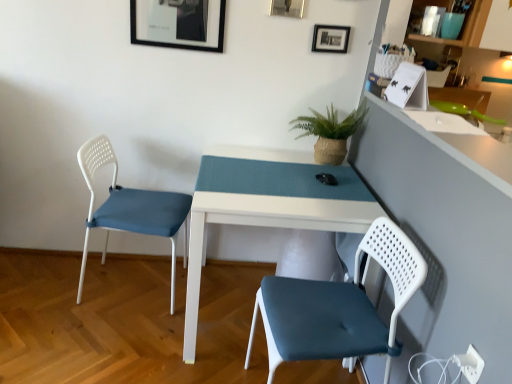
Describe the element at coordinates (465, 28) in the screenshot. I see `matte glass shelf at upper right` at that location.

This screenshot has height=384, width=512. Find the location of `white matte table at center`. white matte table at center is located at coordinates (268, 205).

Describe the element at coordinates (131, 209) in the screenshot. I see `white plastic chair at left, which is the second chair from right to left` at that location.

The width and height of the screenshot is (512, 384). What do you see at coordinates (178, 24) in the screenshot? I see `matte black picture frame at upper center, marked as the 3th picture frame in a right-to-left arrangement` at bounding box center [178, 24].

Measure the distance between matte white chair at lower right, the 1th chair from the right, and camera.

matte white chair at lower right, the 1th chair from the right, and camera are 1.26 meters apart.

Find the location of a particular element. The image size is (512, 384). matte white chair at lower right, which appears as the second chair when viewed from the back is located at coordinates (338, 307).

Locate an element on the screen. matte glass shelf at upper right is located at coordinates (465, 28).

Is point (479, 30) closer or farther from the camera than point (274, 14)?

Point (479, 30).

Which object is wider, matte glass shelf at upper right or metallic silver picture frame at upper center, placed as the 2th picture frame when sorted from left to right?

matte glass shelf at upper right.

From a real-world perspective, which is physically below, matte glass shelf at upper right or metallic silver picture frame at upper center, placed as the 2th picture frame when sorted from left to right?

matte glass shelf at upper right is physically lower.

How many degrees apart are the facing directions of matte glass shelf at upper right and metallic silver picture frame at upper center, placed as the 2th picture frame when sorted from left to right?

The facing directions of matte glass shelf at upper right and metallic silver picture frame at upper center, placed as the 2th picture frame when sorted from left to right, are 49.9 degrees apart.

Considering the sizes of objects white plastic chair at left, the 1th chair viewed from the left, and white matte table at center in the image provided, who is smaller, white plastic chair at left, the 1th chair viewed from the left, or white matte table at center?

white plastic chair at left, the 1th chair viewed from the left, is smaller.

Does white plastic chair at left, the 1th chair viewed from the left, have a lesser height compared to white matte table at center?

No, white plastic chair at left, the 1th chair viewed from the left, is not shorter than white matte table at center.

Are white plastic chair at left, positioned as the 2th chair in front-to-back order, and white matte table at center located far from each other?

That's not correct — white plastic chair at left, positioned as the 2th chair in front-to-back order, is a little close to white matte table at center.

The image size is (512, 384). Find the location of `the 2nd picture frame counting from the right side of the white matte table at center`. the 2nd picture frame counting from the right side of the white matte table at center is located at coordinates (330, 38).

Based on the photo, between white matte table at center and black matte picture frame at upper center, which appears as the 3th picture frame when viewed from the left, which one has more height?

Standing taller between the two is white matte table at center.

Which object is closer to the camera, white matte table at center or black matte picture frame at upper center, which is the 1th picture frame from right to left?

white matte table at center is in front.

Which of these two, white matte table at center or black matte picture frame at upper center, which is the 1th picture frame from right to left, is bigger?

With larger size is white matte table at center.

How many degrees apart are the facing directions of green woven pot at upper center and metallic silver picture frame at upper center, acting as the second picture frame starting from the right?

green woven pot at upper center and metallic silver picture frame at upper center, acting as the second picture frame starting from the right, are facing 1.02 degrees away from each other.

Is green woven pot at upper center aimed at metallic silver picture frame at upper center, placed as the 2th picture frame when sorted from left to right?

No, green woven pot at upper center is not aimed at metallic silver picture frame at upper center, placed as the 2th picture frame when sorted from left to right.

Considering the relative sizes of green woven pot at upper center and metallic silver picture frame at upper center, placed as the 2th picture frame when sorted from left to right, in the image provided, is green woven pot at upper center shorter than metallic silver picture frame at upper center, placed as the 2th picture frame when sorted from left to right,?

No.

Which of these two, green woven pot at upper center or metallic silver picture frame at upper center, placed as the 2th picture frame when sorted from left to right, is smaller?

With smaller size is metallic silver picture frame at upper center, placed as the 2th picture frame when sorted from left to right.

Are white plastic chair at left, the 1th chair viewed from the left, and matte glass shelf at upper right located far from each other?

Indeed, white plastic chair at left, the 1th chair viewed from the left, is not near matte glass shelf at upper right.

In the scene shown: Can you confirm if white plastic chair at left, which is the second chair from right to left, is taller than matte glass shelf at upper right?

Yes, white plastic chair at left, which is the second chair from right to left, is taller than matte glass shelf at upper right.

From a real-world perspective, does white plastic chair at left, positioned as the 2th chair in front-to-back order, sit lower than matte glass shelf at upper right?

Yes, from a real-world perspective, white plastic chair at left, positioned as the 2th chair in front-to-back order, is under matte glass shelf at upper right.

Is metallic silver picture frame at upper center, placed as the 2th picture frame when sorted from left to right, to the right of matte black picture frame at upper center, the first picture frame from the left, from the viewer's perspective?

Yes, metallic silver picture frame at upper center, placed as the 2th picture frame when sorted from left to right, is to the right of matte black picture frame at upper center, the first picture frame from the left.

Could you measure the distance between metallic silver picture frame at upper center, placed as the 2th picture frame when sorted from left to right, and matte black picture frame at upper center, the first picture frame from the left?

metallic silver picture frame at upper center, placed as the 2th picture frame when sorted from left to right, is 16.54 inches from matte black picture frame at upper center, the first picture frame from the left.

Considering the positions of point (295, 5) and point (131, 22), is point (295, 5) closer or farther from the camera than point (131, 22)?

Clearly, point (295, 5) is more distant from the camera than point (131, 22).

This screenshot has width=512, height=384. I want to click on the 1st picture frame behind the matte black picture frame at upper center, the first picture frame from the left, starting your count from the anchor, so click(x=287, y=8).

Is black matte picture frame at upper center, which appears as the 3th picture frame when viewed from the left, facing towards green woven pot at upper center?

No, black matte picture frame at upper center, which appears as the 3th picture frame when viewed from the left, does not turn towards green woven pot at upper center.

Considering the relative sizes of black matte picture frame at upper center, which is the 1th picture frame from right to left, and green woven pot at upper center in the image provided, is black matte picture frame at upper center, which is the 1th picture frame from right to left, smaller than green woven pot at upper center?

Indeed, black matte picture frame at upper center, which is the 1th picture frame from right to left, has a smaller size compared to green woven pot at upper center.

Is black matte picture frame at upper center, which appears as the 3th picture frame when viewed from the left, to the left or to the right of green woven pot at upper center in the image?

black matte picture frame at upper center, which appears as the 3th picture frame when viewed from the left, is to the right of green woven pot at upper center.

In order to click on shelf lying in front of the metallic silver picture frame at upper center, placed as the 2th picture frame when sorted from left to right in this screenshot , I will do `click(465, 28)`.

From a real-world perspective, count 2nd chairs upward from the white matte table at center and point to it. Please provide its 2D coordinates.

[(131, 209)]

Estimate the real-world distances between objects in this image. Which object is closer to green woven pot at upper center, matte white chair at lower right, marked as the second chair in a left-to-right arrangement, or matte black picture frame at upper center, marked as the 3th picture frame in a right-to-left arrangement?

The object closer to green woven pot at upper center is matte black picture frame at upper center, marked as the 3th picture frame in a right-to-left arrangement.

When comparing their distances from green woven pot at upper center, does white plastic chair at left, the 1th chair viewed from the left, or metallic silver picture frame at upper center, placed as the 2th picture frame when sorted from left to right, seem closer?

metallic silver picture frame at upper center, placed as the 2th picture frame when sorted from left to right.

Based on their spatial positions, is green woven pot at upper center or matte white chair at lower right, which appears as the second chair when viewed from the back, further from metallic silver picture frame at upper center, placed as the 2th picture frame when sorted from left to right?

matte white chair at lower right, which appears as the second chair when viewed from the back, is positioned further to the anchor metallic silver picture frame at upper center, placed as the 2th picture frame when sorted from left to right.

Based on the photo, considering their positions, is matte black picture frame at upper center, marked as the 3th picture frame in a right-to-left arrangement, positioned closer to white matte table at center than green woven pot at upper center?

Based on the image, green woven pot at upper center appears to be nearer to white matte table at center.

Looking at the image, which one is located further to metallic silver picture frame at upper center, acting as the second picture frame starting from the right, white matte table at center or matte glass shelf at upper right?

Based on the image, white matte table at center appears to be further to metallic silver picture frame at upper center, acting as the second picture frame starting from the right.

Looking at the image, which one is located further to matte glass shelf at upper right, white plastic chair at left, the 1th chair viewed from the left, or metallic silver picture frame at upper center, acting as the second picture frame starting from the right?

The object further to matte glass shelf at upper right is white plastic chair at left, the 1th chair viewed from the left.

Based on their spatial positions, is matte black picture frame at upper center, marked as the 3th picture frame in a right-to-left arrangement, or matte white chair at lower right, which is the 1th chair in front-to-back order, closer to black matte picture frame at upper center, which is the 1th picture frame from right to left?

Based on the image, matte black picture frame at upper center, marked as the 3th picture frame in a right-to-left arrangement, appears to be nearer to black matte picture frame at upper center, which is the 1th picture frame from right to left.

From the image, which object appears to be nearer to white plastic chair at left, positioned as the 2th chair in front-to-back order, white matte table at center or matte glass shelf at upper right?

white matte table at center lies closer to white plastic chair at left, positioned as the 2th chair in front-to-back order, than the other object.

At what (x,y) coordinates should I click in order to perform the action: click on picture frame between green woven pot at upper center and matte glass shelf at upper right in the horizontal direction. Please return your answer as a coordinate pair (x, y). The width and height of the screenshot is (512, 384). Looking at the image, I should click on (330, 38).

Image resolution: width=512 pixels, height=384 pixels. I want to click on chair between black matte picture frame at upper center, which is the 1th picture frame from right to left, and white matte table at center from top to bottom, so click(x=131, y=209).

The height and width of the screenshot is (384, 512). Identify the location of houseplant between matte black picture frame at upper center, the first picture frame from the left, and black matte picture frame at upper center, which is the 1th picture frame from right to left. (330, 132).

The image size is (512, 384). What are the coordinates of `houseplant between matte glass shelf at upper right and white matte table at center in the vertical direction` in the screenshot? It's located at click(330, 132).